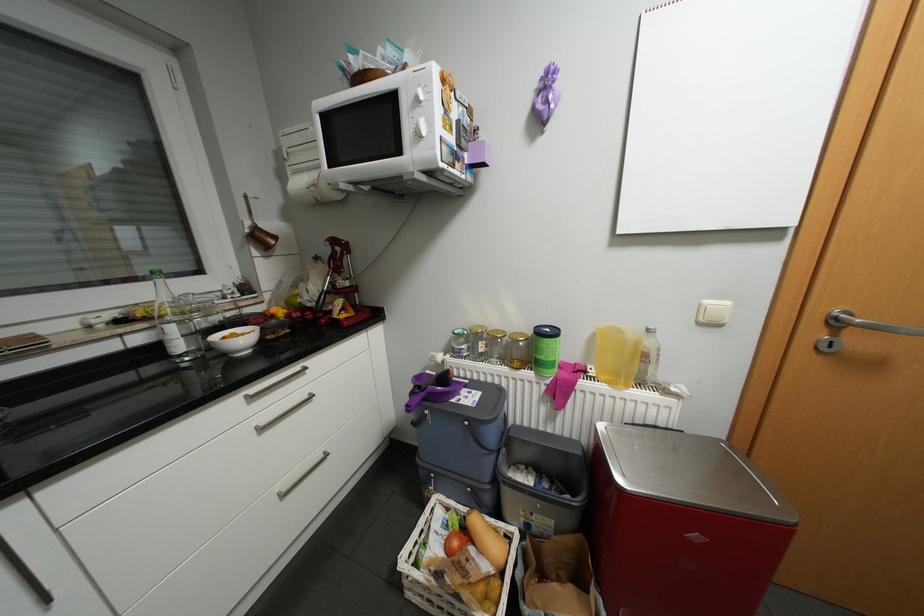
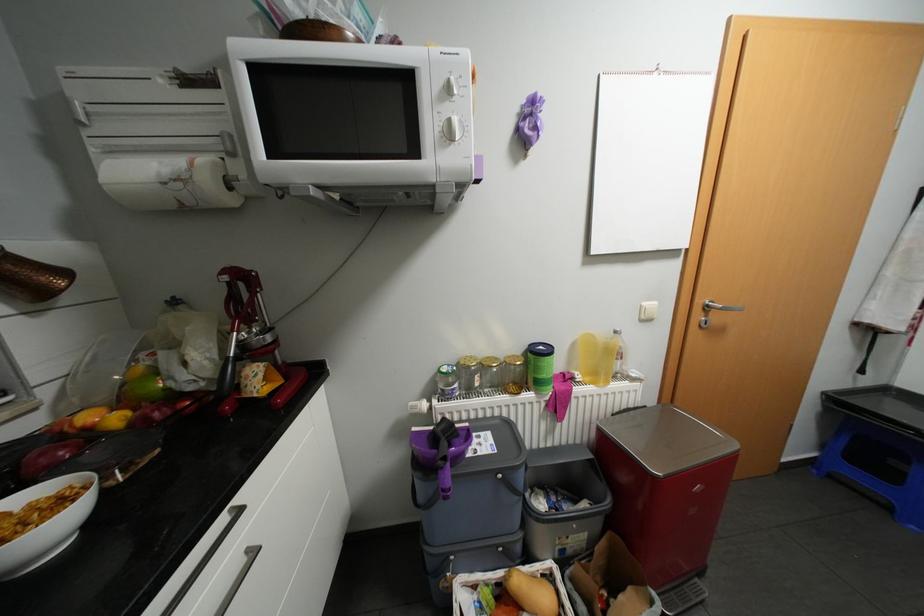
Where in the second image is the point corresponding to pixel 249 339 from the first image?

(44, 522)